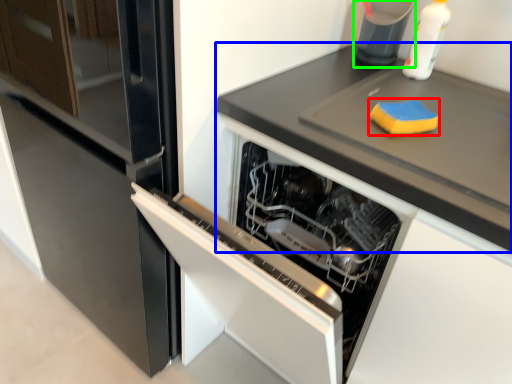
Question: Which object is positioned farthest from food (highlighted by a red box)? Select from countertop (highlighted by a blue box) and appliance (highlighted by a green box).

Choices:
 (A) countertop
 (B) appliance

Answer: (B)